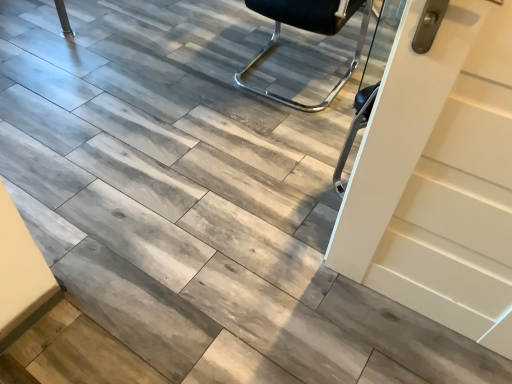
Question: Considering the relative positions of black leather chair at center and white glossy door at right in the image provided, is black leather chair at center to the right of white glossy door at right from the viewer's perspective?

Choices:
 (A) yes
 (B) no

Answer: (B)

Question: From a real-world perspective, is black leather chair at center physically below white glossy door at right?

Choices:
 (A) no
 (B) yes

Answer: (B)

Question: Is the depth of black leather chair at center greater than that of white glossy door at right?

Choices:
 (A) no
 (B) yes

Answer: (B)

Question: Is the depth of black leather chair at center less than that of white glossy door at right?

Choices:
 (A) yes
 (B) no

Answer: (B)

Question: Is black leather chair at center bigger than white glossy door at right?

Choices:
 (A) yes
 (B) no

Answer: (A)

Question: Considering the relative sizes of black leather chair at center and white glossy door at right in the image provided, is black leather chair at center wider than white glossy door at right?

Choices:
 (A) no
 (B) yes

Answer: (B)

Question: Is the position of white glossy door at right less distant than that of black leather chair at center?

Choices:
 (A) no
 (B) yes

Answer: (B)

Question: Considering the relative sizes of white glossy door at right and black leather chair at center in the image provided, is white glossy door at right shorter than black leather chair at center?

Choices:
 (A) yes
 (B) no

Answer: (B)

Question: Are white glossy door at right and black leather chair at center located far from each other?

Choices:
 (A) no
 (B) yes

Answer: (B)

Question: Can you confirm if white glossy door at right is thinner than black leather chair at center?

Choices:
 (A) yes
 (B) no

Answer: (A)

Question: From a real-world perspective, is white glossy door at right below black leather chair at center?

Choices:
 (A) no
 (B) yes

Answer: (A)

Question: Can you confirm if white glossy door at right is wider than black leather chair at center?

Choices:
 (A) yes
 (B) no

Answer: (B)

Question: In the image, is black leather chair at center positioned in front of or behind white glossy door at right?

Choices:
 (A) front
 (B) behind

Answer: (B)